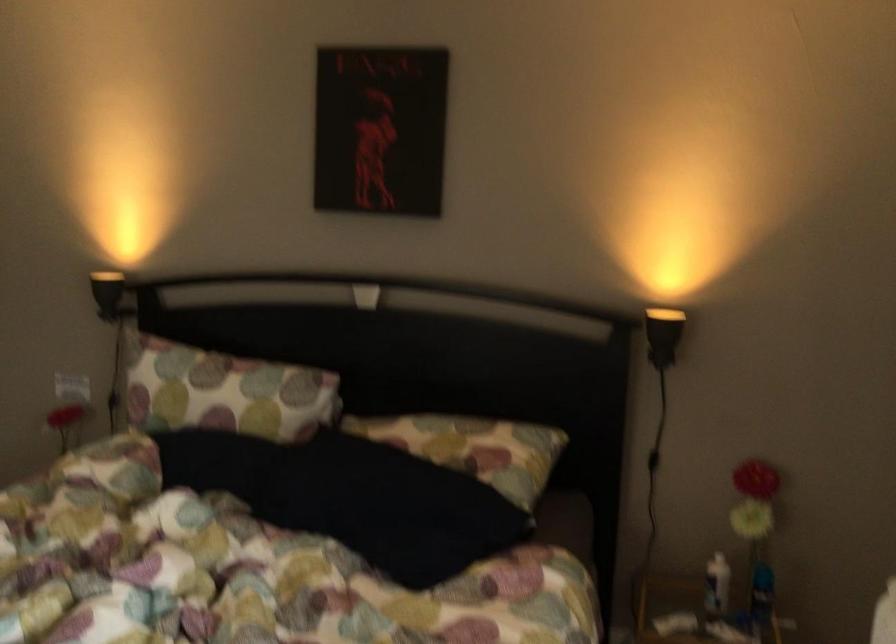
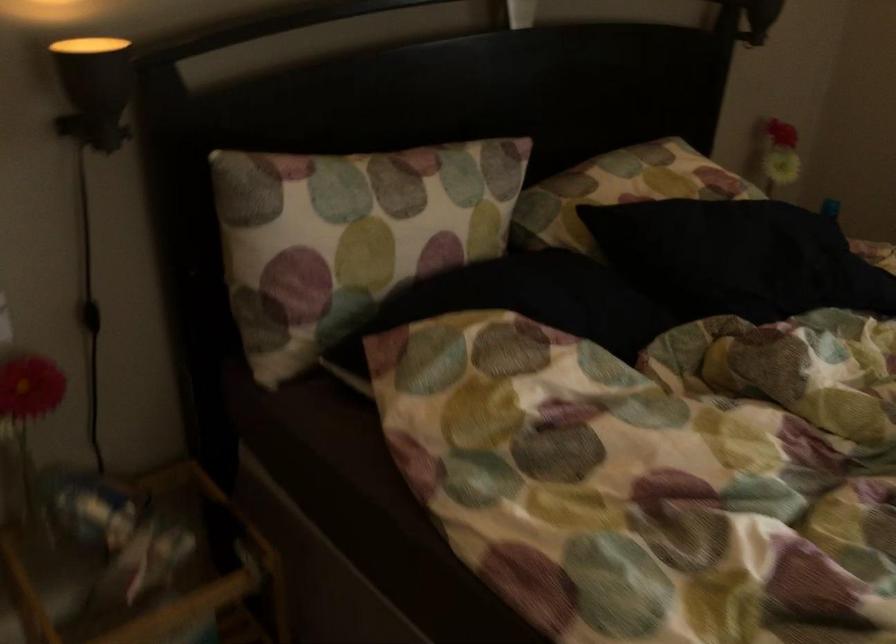
Locate, in the second image, the point that corresponds to pixel 124 272 in the first image.

(90, 48)